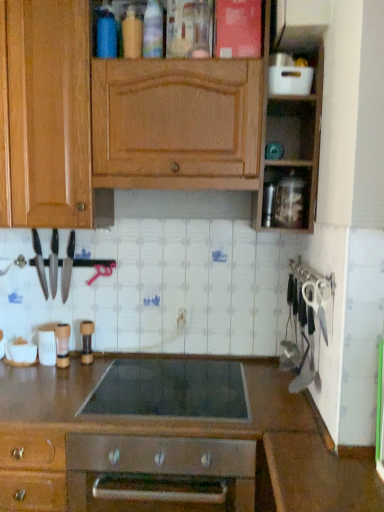
The image size is (384, 512). In order to click on free space in front of clear plastic container at lower left, which is the 4th appliance from right to left in this screenshot , I will do `click(52, 381)`.